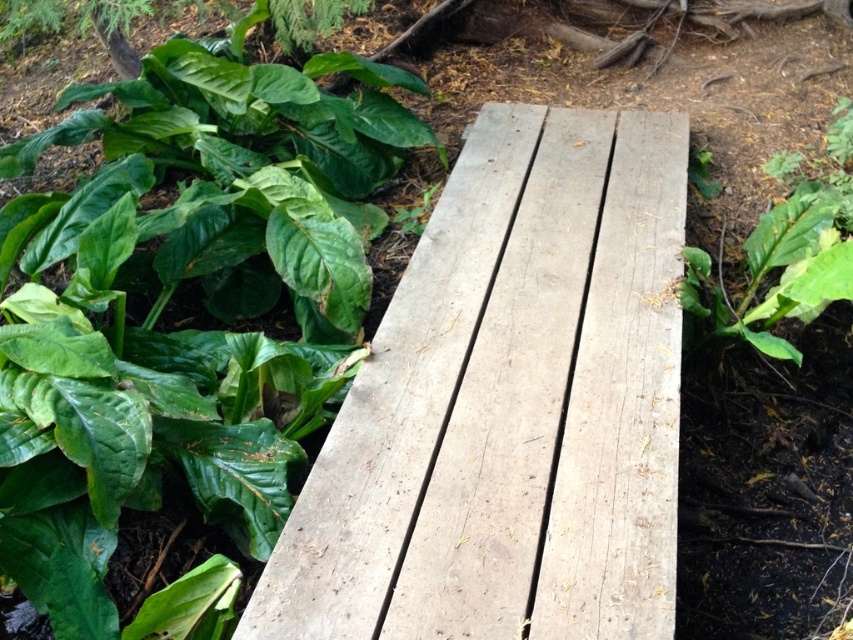
Question: Does green matte leafy plant at upper left appear on the right side of green leafy plant at right?

Choices:
 (A) yes
 (B) no

Answer: (B)

Question: Which object is positioned farthest from the weathered wood bench at center?

Choices:
 (A) green matte leafy plant at upper left
 (B) weathered wood plank at center

Answer: (A)

Question: Which point is closer to the camera?

Choices:
 (A) green matte leafy plant at upper left
 (B) weathered wood bench at center
 (C) green leafy plant at right
 (D) weathered wood plank at center

Answer: (B)

Question: Where is green matte leafy plant at upper left located in relation to weathered wood plank at center in the image?

Choices:
 (A) right
 (B) left

Answer: (B)

Question: Which object is farther from the camera taking this photo?

Choices:
 (A) green leafy plant at right
 (B) weathered wood bench at center

Answer: (A)

Question: Does green matte leafy plant at upper left come in front of weathered wood plank at center?

Choices:
 (A) no
 (B) yes

Answer: (A)